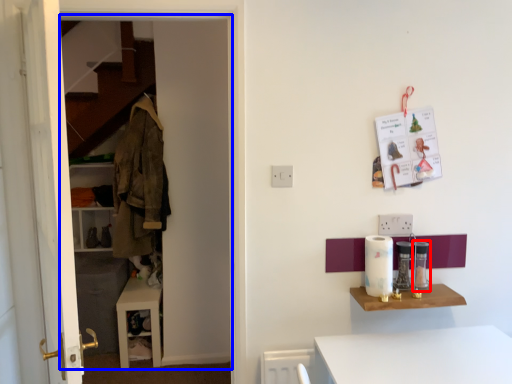
Question: Which point is further to the camera, appliance (highlighted by a red box) or dresser (highlighted by a blue box)?

Choices:
 (A) appliance
 (B) dresser

Answer: (A)